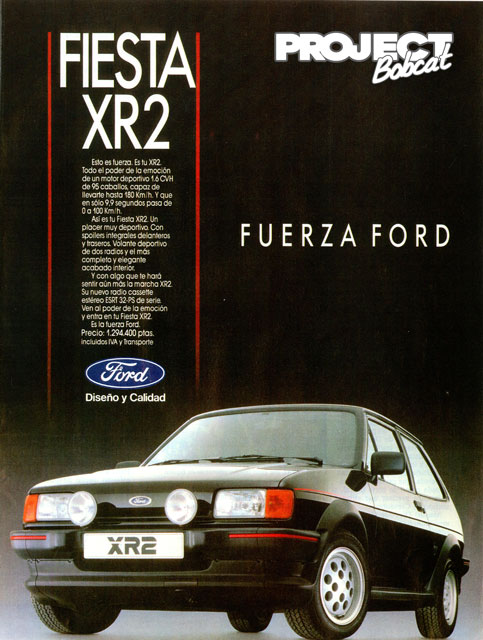
This screenshot has height=640, width=483. I want to click on door handle, so click(x=418, y=504).